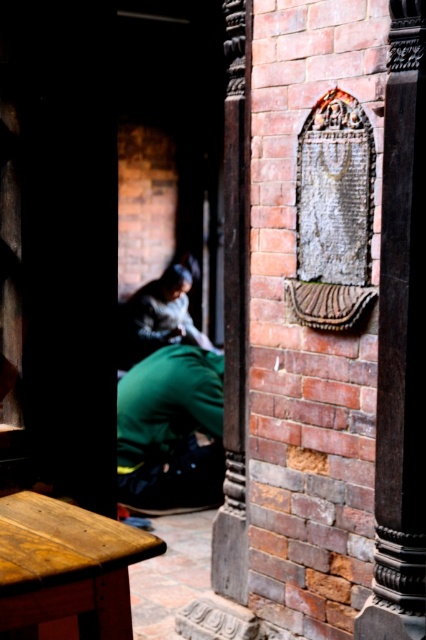
You are standing in front of a brick wall with an embedded stone plaque. There is a point marked at coordinates (400, 344). Which object does this point correspond to?

The point corresponds to the smooth stone pillar at center.

You are standing in front of a brick wall with two points marked. The first point is at coordinates point (405, 17) and the second is at point (233, 154). Which of these points is closer to you?

Point (405, 17) is in front of point (233, 154), so it is closer to you.